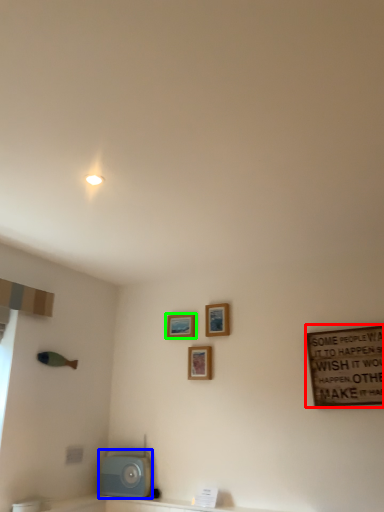
Question: Based on their relative distances, which object is nearer to bulletin board (highlighted by a red box)? Choose from appliance (highlighted by a blue box) and picture frame (highlighted by a green box).

Choices:
 (A) appliance
 (B) picture frame

Answer: (B)